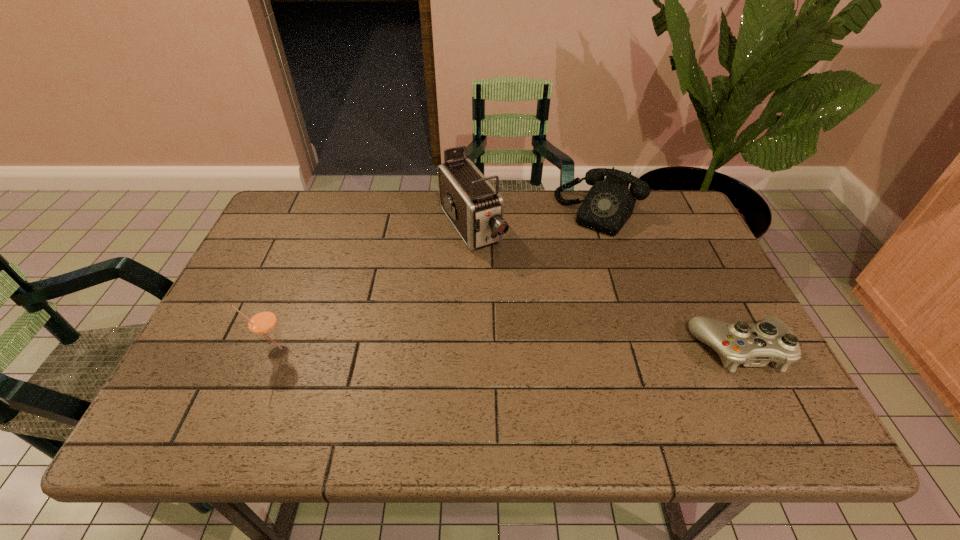
I want to click on vacant space on the desktop that is between the straw and the control and is positioned at the lens of the second object from left to right, so click(x=562, y=350).

Identify the location of vacant space on the desktop that is between the leftmost object and the shortest object and is positioned on the dial of the telephone. (506, 351).